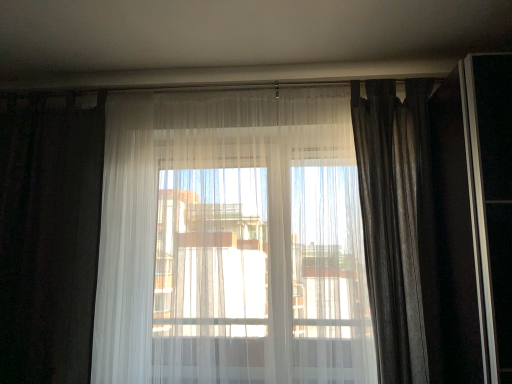
Question: Is silky gray curtain at right, the 3th curtain in the left-to-right sequence, oriented away from sheer white curtain at center, the 2th curtain from the left?

Choices:
 (A) no
 (B) yes

Answer: (A)

Question: Is silky gray curtain at right, which is the first curtain in right-to-left order, positioned in front of sheer white curtain at center, the 2th curtain from the left?

Choices:
 (A) yes
 (B) no

Answer: (B)

Question: Is silky gray curtain at right, which is the first curtain in right-to-left order, aimed at sheer white curtain at center, which ranks as the 2th curtain in right-to-left order?

Choices:
 (A) no
 (B) yes

Answer: (A)

Question: Can you confirm if silky gray curtain at right, which is the first curtain in right-to-left order, is positioned to the right of sheer white curtain at center, which ranks as the 2th curtain in right-to-left order?

Choices:
 (A) no
 (B) yes

Answer: (B)

Question: Would you say sheer white curtain at center, which ranks as the 2th curtain in right-to-left order, is part of silky gray curtain at right, which is the first curtain in right-to-left order,'s contents?

Choices:
 (A) yes
 (B) no

Answer: (B)

Question: Looking at the image, does sheer white curtain at center, the 2th curtain from the left, seem bigger or smaller compared to white sheer curtain at left, the 3th curtain positioned from the right?

Choices:
 (A) big
 (B) small

Answer: (A)

Question: From their relative heights in the image, would you say sheer white curtain at center, the 2th curtain from the left, is taller or shorter than white sheer curtain at left, the first curtain positioned from the left?

Choices:
 (A) short
 (B) tall

Answer: (B)

Question: From the image's perspective, is sheer white curtain at center, which ranks as the 2th curtain in right-to-left order, positioned above or below white sheer curtain at left, the first curtain positioned from the left?

Choices:
 (A) below
 (B) above

Answer: (B)

Question: Would you say sheer white curtain at center, the 2th curtain from the left, is inside or outside white sheer curtain at left, the 3th curtain positioned from the right?

Choices:
 (A) outside
 (B) inside

Answer: (A)

Question: Is white sheer curtain at left, the 3th curtain positioned from the right, to the left or to the right of silky gray curtain at right, which is the first curtain in right-to-left order, in the image?

Choices:
 (A) right
 (B) left

Answer: (B)

Question: In terms of height, does white sheer curtain at left, the first curtain positioned from the left, look taller or shorter compared to silky gray curtain at right, the 3th curtain in the left-to-right sequence?

Choices:
 (A) short
 (B) tall

Answer: (B)

Question: From the image's perspective, is white sheer curtain at left, the first curtain positioned from the left, positioned above or below silky gray curtain at right, which is the first curtain in right-to-left order?

Choices:
 (A) below
 (B) above

Answer: (A)

Question: From a real-world perspective, is white sheer curtain at left, the first curtain positioned from the left, above or below silky gray curtain at right, the 3th curtain in the left-to-right sequence?

Choices:
 (A) below
 (B) above

Answer: (A)

Question: Considering the positions of silky gray curtain at right, the 3th curtain in the left-to-right sequence, and white sheer curtain at left, the 3th curtain positioned from the right, in the image, is silky gray curtain at right, the 3th curtain in the left-to-right sequence, taller or shorter than white sheer curtain at left, the 3th curtain positioned from the right,?

Choices:
 (A) tall
 (B) short

Answer: (B)

Question: Does point (380, 87) appear closer or farther from the camera than point (72, 329)?

Choices:
 (A) farther
 (B) closer

Answer: (A)